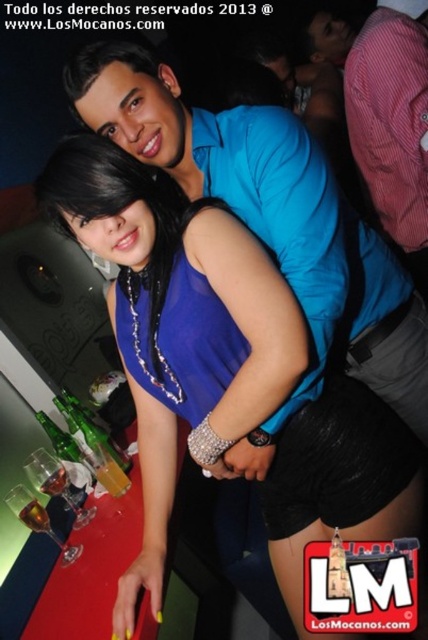
Question: Can you confirm if satin blue dress at center is thinner than blue shirt at upper center?

Choices:
 (A) yes
 (B) no

Answer: (B)

Question: Which point is closer to the camera?

Choices:
 (A) (354, 58)
 (B) (288, 522)

Answer: (B)

Question: Which point appears closest to the camera in this image?

Choices:
 (A) (276, 500)
 (B) (395, 100)

Answer: (A)

Question: Which of the following is the closest to the observer?

Choices:
 (A) (422, 170)
 (B) (196, 376)

Answer: (B)

Question: Does satin blue dress at center appear under blue shirt at upper center?

Choices:
 (A) yes
 (B) no

Answer: (A)

Question: Considering the relative positions of satin blue dress at center and blue shirt at upper center in the image provided, where is satin blue dress at center located with respect to blue shirt at upper center?

Choices:
 (A) left
 (B) right

Answer: (A)